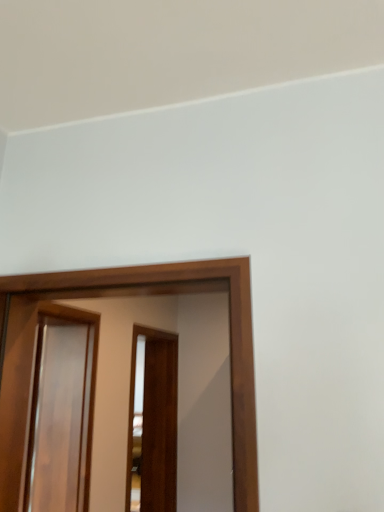
Question: Considering the relative sizes of glossy wood screen door at center, which appears as the first screen door when viewed from the front, and brown wooden screen door at center, which appears as the 1th screen door when viewed from the back, in the image provided, is glossy wood screen door at center, which appears as the first screen door when viewed from the front, bigger than brown wooden screen door at center, which appears as the 1th screen door when viewed from the back,?

Choices:
 (A) no
 (B) yes

Answer: (A)

Question: Can you confirm if glossy wood screen door at center, which appears as the first screen door when viewed from the front, is smaller than brown wooden screen door at center, positioned as the third screen door in front-to-back order?

Choices:
 (A) yes
 (B) no

Answer: (A)

Question: Is glossy wood screen door at center, which appears as the first screen door when viewed from the front, positioned with its back to brown wooden screen door at center, positioned as the third screen door in front-to-back order?

Choices:
 (A) no
 (B) yes

Answer: (B)

Question: Is the depth of glossy wood screen door at center, which appears as the first screen door when viewed from the front, greater than that of brown wooden screen door at center, positioned as the third screen door in front-to-back order?

Choices:
 (A) no
 (B) yes

Answer: (A)

Question: Considering the relative sizes of glossy wood screen door at center, the 3th screen door when ordered from back to front, and brown wooden screen door at center, positioned as the third screen door in front-to-back order, in the image provided, is glossy wood screen door at center, the 3th screen door when ordered from back to front, shorter than brown wooden screen door at center, positioned as the third screen door in front-to-back order,?

Choices:
 (A) no
 (B) yes

Answer: (B)

Question: In terms of height, does glossy wood screen door at left, which is the second screen door in back-to-front order, look taller or shorter compared to glossy wood screen door at center, which appears as the first screen door when viewed from the front?

Choices:
 (A) short
 (B) tall

Answer: (B)

Question: Considering the positions of point (44, 434) and point (34, 279), is point (44, 434) closer or farther from the camera than point (34, 279)?

Choices:
 (A) farther
 (B) closer

Answer: (A)

Question: Considering their positions, is glossy wood screen door at left, positioned as the 2th screen door in front-to-back order, located in front of or behind glossy wood screen door at center, which appears as the first screen door when viewed from the front?

Choices:
 (A) behind
 (B) front

Answer: (A)

Question: From the image's perspective, is glossy wood screen door at left, which is the second screen door in back-to-front order, positioned above or below glossy wood screen door at center, which appears as the first screen door when viewed from the front?

Choices:
 (A) above
 (B) below

Answer: (B)

Question: Considering their positions, is glossy wood screen door at center, which appears as the first screen door when viewed from the front, located in front of or behind glossy wood screen door at left, positioned as the 2th screen door in front-to-back order?

Choices:
 (A) front
 (B) behind

Answer: (A)

Question: From a real-world perspective, is glossy wood screen door at center, which appears as the first screen door when viewed from the front, physically located above or below glossy wood screen door at left, which is the second screen door in back-to-front order?

Choices:
 (A) below
 (B) above

Answer: (B)

Question: Is point (243, 260) positioned closer to the camera than point (48, 410)?

Choices:
 (A) closer
 (B) farther

Answer: (A)

Question: In terms of size, does glossy wood screen door at center, which appears as the first screen door when viewed from the front, appear bigger or smaller than glossy wood screen door at left, positioned as the 2th screen door in front-to-back order?

Choices:
 (A) small
 (B) big

Answer: (A)

Question: Considering the positions of point (97, 281) and point (144, 415), is point (97, 281) closer or farther from the camera than point (144, 415)?

Choices:
 (A) closer
 (B) farther

Answer: (A)

Question: Which is correct: glossy wood screen door at center, the 3th screen door when ordered from back to front, is inside brown wooden screen door at center, which appears as the 1th screen door when viewed from the back, or outside of it?

Choices:
 (A) outside
 (B) inside

Answer: (A)